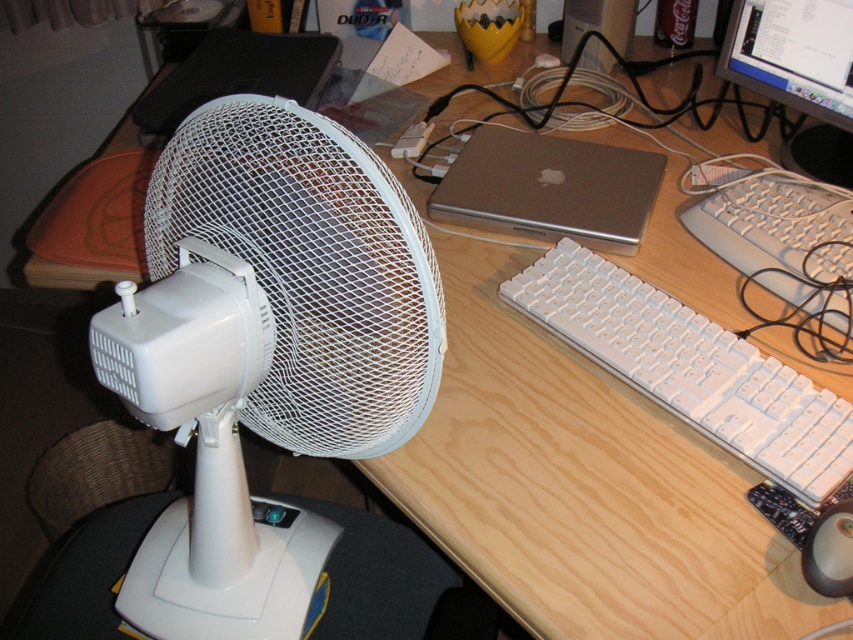
In the scene shown: Is white plastic keyboard at center-right below white plastic keyboard at right?

Yes, white plastic keyboard at center-right is below white plastic keyboard at right.

Which is below, white plastic keyboard at center-right or white plastic keyboard at right?

white plastic keyboard at center-right

Where is `white plastic keyboard at center-right`? Image resolution: width=853 pixels, height=640 pixels. white plastic keyboard at center-right is located at coordinates (691, 369).

Is point (262, 413) closer to camera compared to point (468, 196)?

Yes.

The height and width of the screenshot is (640, 853). Find the location of `white plastic fan at left`. white plastic fan at left is located at coordinates (265, 352).

Describe the element at coordinates (265, 352) in the screenshot. This screenshot has width=853, height=640. I see `white plastic fan at left` at that location.

Who is shorter, white plastic fan at left or white plastic keyboard at center-right?

white plastic keyboard at center-right

Locate an element on the screen. white plastic fan at left is located at coordinates (265, 352).

I want to click on white plastic fan at left, so click(265, 352).